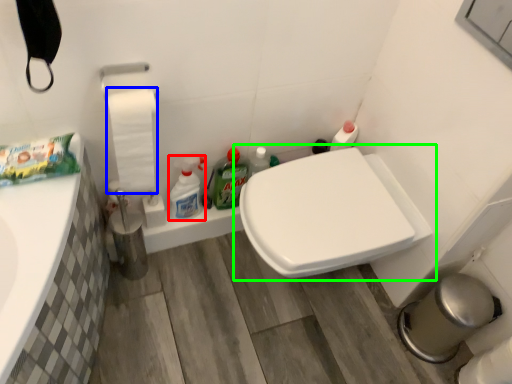
Question: Considering the real-world distances, which object is closest to cleaning product (highlighted by a red box)? toilet paper (highlighted by a blue box) or toilet (highlighted by a green box).

Choices:
 (A) toilet paper
 (B) toilet

Answer: (A)